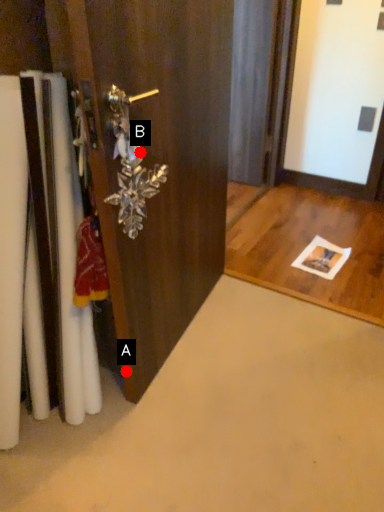
Question: Two points are circled on the image, labeled by A and B beside each circle. Among these points, which one is farthest from the camera?

Choices:
 (A) A is further
 (B) B is further

Answer: (A)